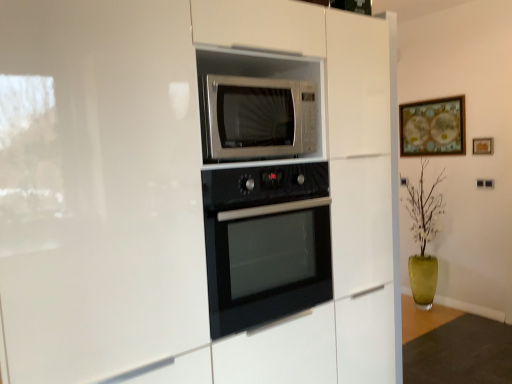
Question: Is satin silver microwave at center wider or thinner than black glass oven at center?

Choices:
 (A) thin
 (B) wide

Answer: (A)

Question: From the image's perspective, relative to black glass oven at center, is satin silver microwave at center above or below?

Choices:
 (A) above
 (B) below

Answer: (A)

Question: Estimate the real-world distances between objects in this image. Which object is closer to the black glass oven at center?

Choices:
 (A) satin silver microwave at center
 (B) wooden framed map at upper right, the 1th picture frame viewed from the back
 (C) wooden picture frame at upper right, the 1th picture frame when ordered from front to back

Answer: (A)

Question: Which object is positioned closest to the wooden picture frame at upper right, the 1th picture frame when ordered from right to left?

Choices:
 (A) satin silver microwave at center
 (B) wooden framed map at upper right, arranged as the first picture frame when viewed from the left
 (C) black glass oven at center

Answer: (B)